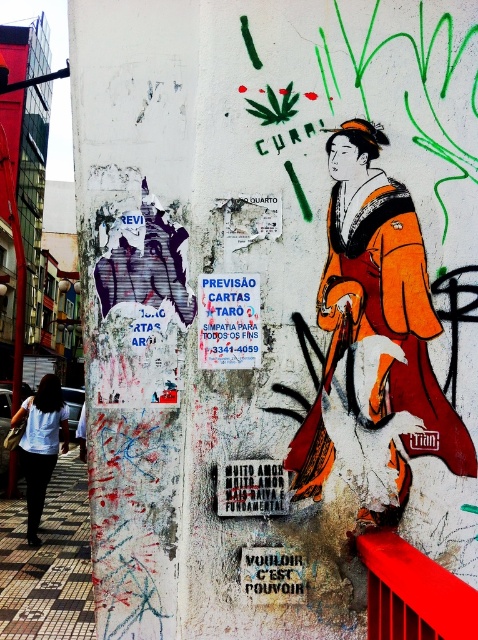
Question: Does blue paper poster at center appear under white cotton shirt at lower left?

Choices:
 (A) yes
 (B) no

Answer: (B)

Question: Which point is closer to the camera taking this photo?

Choices:
 (A) (251, 300)
 (B) (29, 476)
 (C) (400, 538)

Answer: (C)

Question: Which object appears closest to the camera in this image?

Choices:
 (A) white cotton shirt at lower left
 (B) orange silk kimono at center
 (C) blue paper poster at center
 (D) smooth metal rail at lower right

Answer: (D)

Question: Is the position of orange silk kimono at center more distant than that of smooth metal rail at lower right?

Choices:
 (A) yes
 (B) no

Answer: (A)

Question: Is smooth metal rail at lower right positioned before white cotton shirt at lower left?

Choices:
 (A) no
 (B) yes

Answer: (B)

Question: Which object is closer to the camera taking this photo?

Choices:
 (A) smooth metal rail at lower right
 (B) orange silk kimono at center
 (C) blue paper poster at center

Answer: (A)